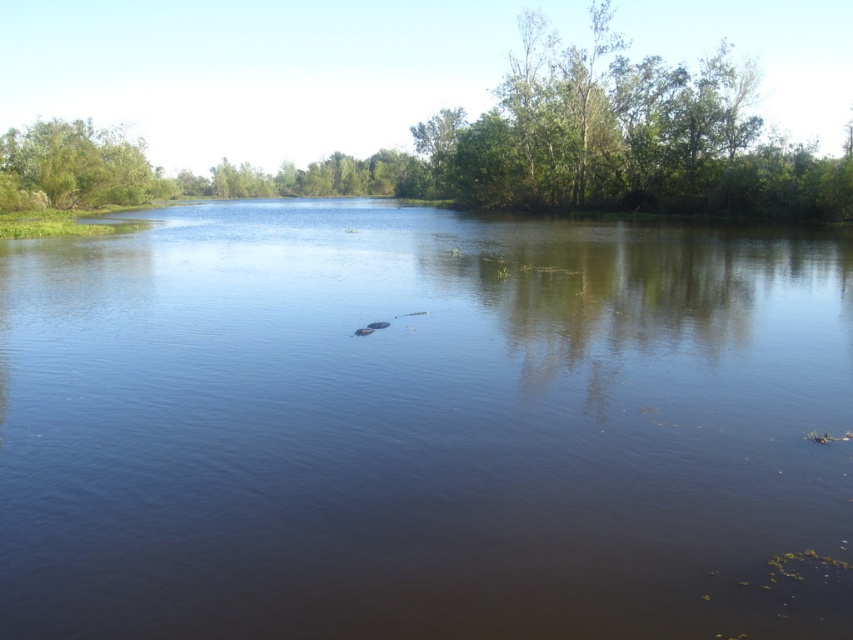
You are an environmental scientist assessing the health of this water body. You observe the brown murky water at center and the green leafy tree at upper left. Which object spans a greater horizontal distance across the image?

The brown murky water at center spans a greater horizontal distance than the green leafy tree at upper left because its width surpasses the tree.

Looking at the green leafy trees at upper center and the green leafy tree at upper left in the scene, which one has a wider spread of branches?

The green leafy trees at upper center has a wider spread of branches than the green leafy tree at upper left.